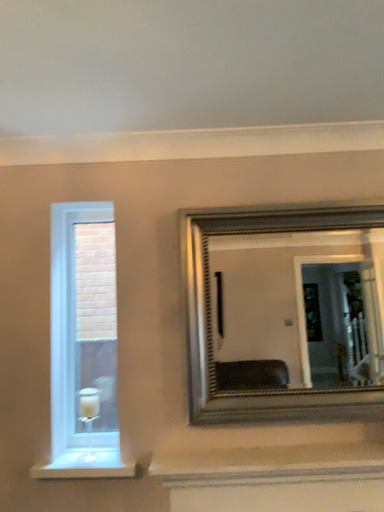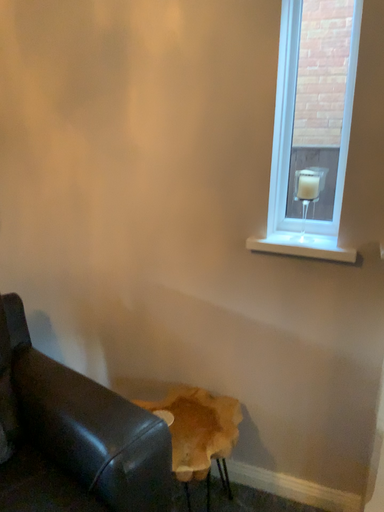
Question: How did the camera likely rotate when shooting the video?

Choices:
 (A) rotated left
 (B) rotated right

Answer: (A)